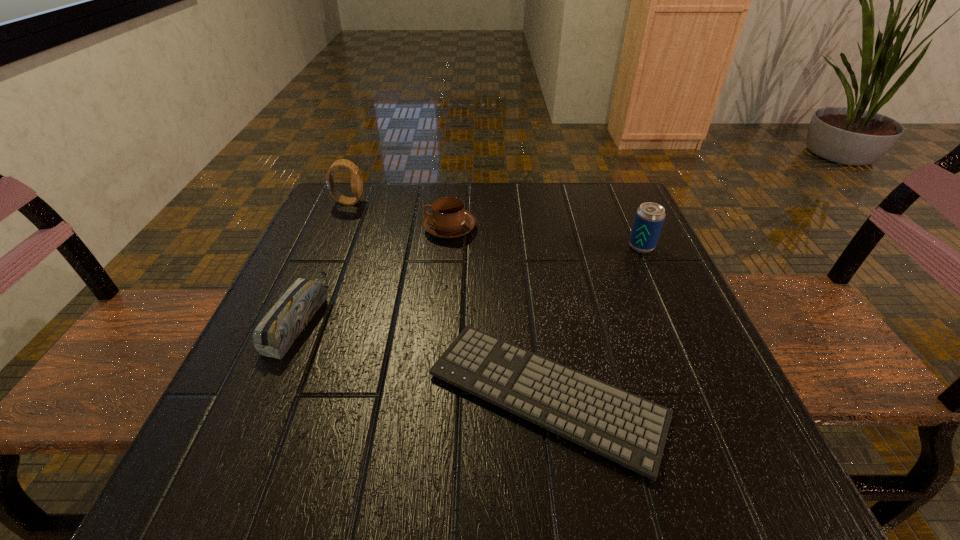
Find the location of a particular element. object that is positioned at the near right corner is located at coordinates 623,427.

Where is `free space at the far edge of the desktop`? Image resolution: width=960 pixels, height=540 pixels. free space at the far edge of the desktop is located at coordinates (488, 202).

The height and width of the screenshot is (540, 960). What are the coordinates of `vacant space at the near edge of the desktop` in the screenshot? It's located at (639, 483).

Where is `vacant space at the left edge`? vacant space at the left edge is located at coordinates (345, 271).

Locate an element on the screen. vacant position at the right edge of the desktop is located at coordinates (690, 340).

Where is `free space at the far left corner of the desktop`? free space at the far left corner of the desktop is located at coordinates (373, 194).

In the image, there is a desktop. At what (x,y) coordinates should I click in order to perform the action: click on blank space at the near left corner. Please return your answer as a coordinate pair (x, y). The height and width of the screenshot is (540, 960). Looking at the image, I should click on (184, 481).

The height and width of the screenshot is (540, 960). I want to click on vacant area that lies between the computer keyboard and the rightmost object, so click(594, 320).

This screenshot has height=540, width=960. In order to click on free spot between the beer can and the watch in this screenshot , I will do `click(494, 224)`.

Find the location of a particular element. This screenshot has height=540, width=960. vacant area that lies between the rightmost object and the shortest object is located at coordinates (594, 320).